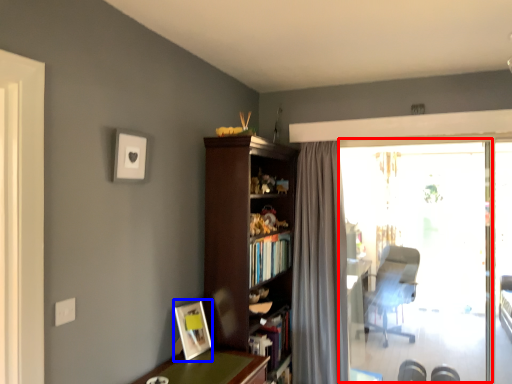
Question: Which point is closer to the camera, window screen (highlighted by a red box) or picture frame (highlighted by a blue box)?

Choices:
 (A) window screen
 (B) picture frame

Answer: (B)